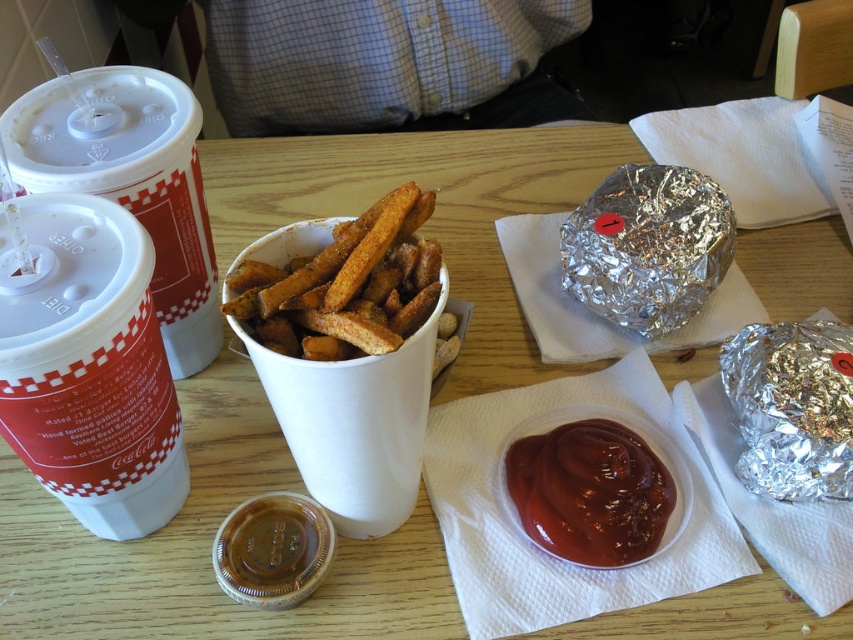
Who is lower down, white paper cup at left or white plastic cup at upper left?

white paper cup at left

Is white paper cup at left further to camera compared to white plastic cup at upper left?

No.

Is point (149, 472) more distant than point (115, 131)?

No, it is not.

You are a GUI agent. You are given a task and a screenshot of the screen. Output one action in this format:
    pyautogui.click(x=<x>, y=<y>)
    Task: Click on the white paper cup at left
    This screenshot has height=640, width=853.
    Given the screenshot: What is the action you would take?
    90,365

Between point (79, 179) and point (641, 515), which one is positioned in front?

Positioned in front is point (79, 179).

This screenshot has width=853, height=640. I want to click on white plastic cup at upper left, so click(131, 182).

Which is above, white plastic cup at upper left or golden crispy french fries at center?

white plastic cup at upper left is above.

Does white plastic cup at upper left appear under golden crispy french fries at center?

No, white plastic cup at upper left is not below golden crispy french fries at center.

Between point (187, 310) and point (234, 307), which one is positioned behind?

Point (187, 310)

This screenshot has height=640, width=853. I want to click on white plastic cup at upper left, so (131, 182).